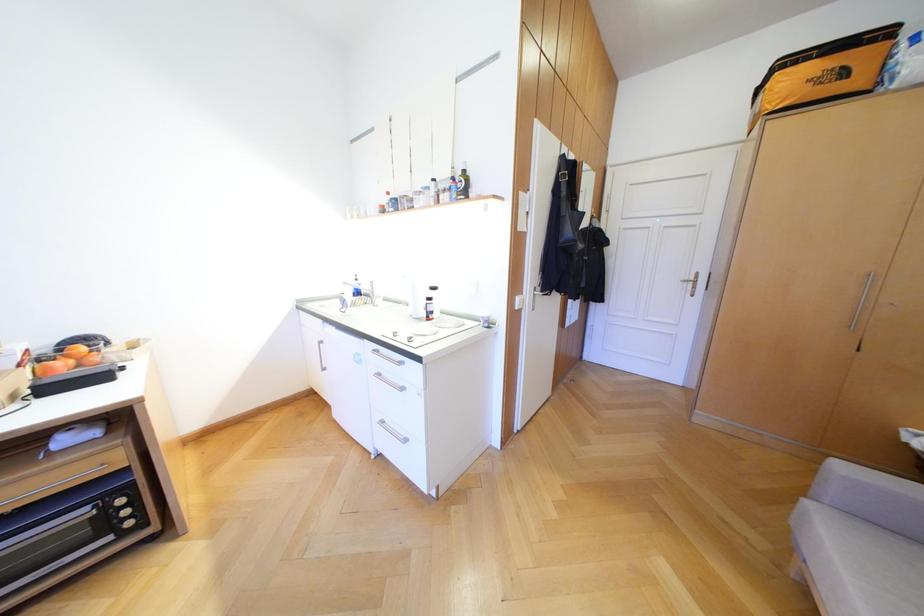
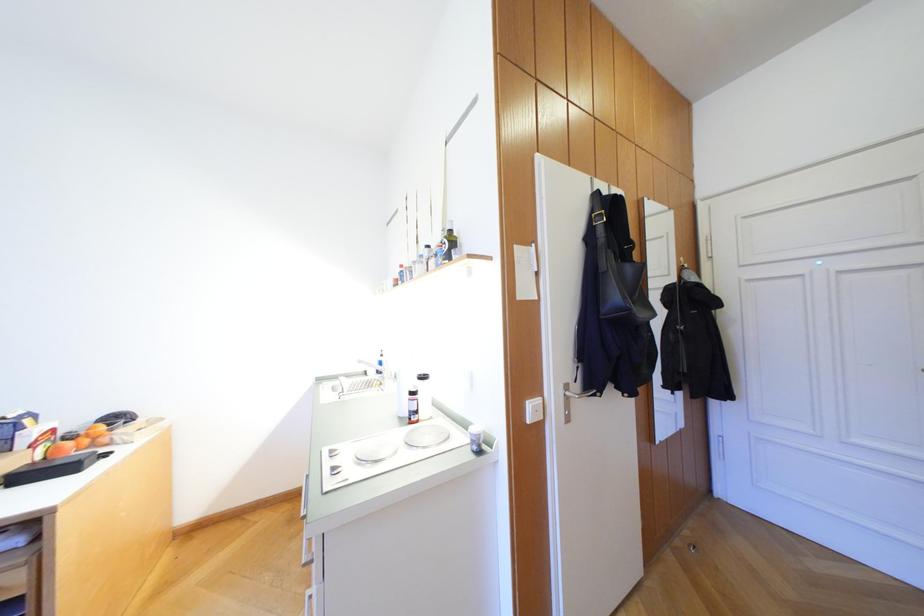
Question: How did the camera likely rotate?

Choices:
 (A) Left
 (B) Right
 (C) Up
 (D) Down

Answer: (A)